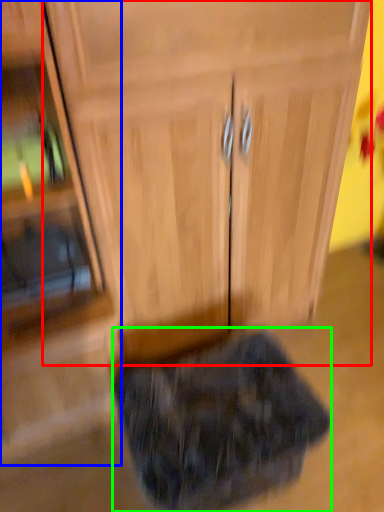
Question: Considering the real-world distances, which object is farthest from cabinetry (highlighted by a red box)? side cabinet (highlighted by a blue box) or animal (highlighted by a green box)?

Choices:
 (A) side cabinet
 (B) animal

Answer: (B)